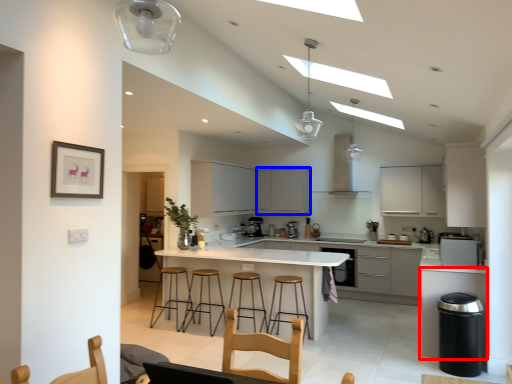
Question: Which object appears closest to the camera in this image, cabinetry (highlighted by a red box) or cabinetry (highlighted by a blue box)?

Choices:
 (A) cabinetry
 (B) cabinetry

Answer: (A)